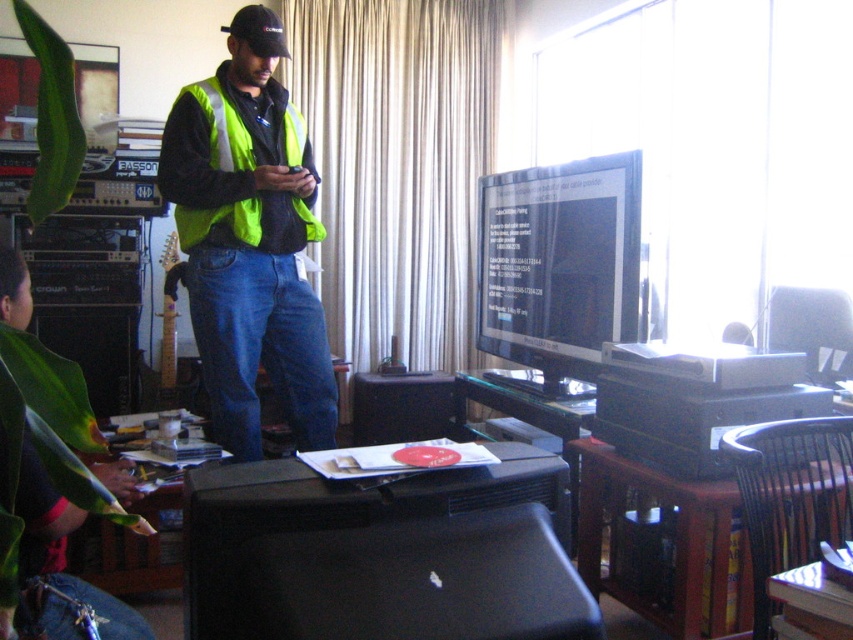
Which is below, black matte printer at lower center or high visibility vest at center?

Positioned lower is black matte printer at lower center.

Can you confirm if black matte printer at lower center is bigger than high visibility vest at center?

No, black matte printer at lower center is not bigger than high visibility vest at center.

Does point (396, 593) come closer to viewer compared to point (193, 108)?

Yes, point (396, 593) is closer to viewer.

In order to click on black matte printer at lower center in this screenshot , I will do point(381,556).

At what (x,y) coordinates should I click in order to perform the action: click on high visibility vest at center. Please return your answer as a coordinate pair (x, y). The image size is (853, 640). Looking at the image, I should click on (248, 240).

Who is lower down, high visibility vest at center or neon yellow reflective safety vest at center?

high visibility vest at center

Describe the element at coordinates (248, 240) in the screenshot. I see `high visibility vest at center` at that location.

You are a GUI agent. You are given a task and a screenshot of the screen. Output one action in this format:
    pyautogui.click(x=<x>, y=<y>)
    Task: Click on the high visibility vest at center
    
    Given the screenshot: What is the action you would take?
    pyautogui.click(x=248, y=240)

Which is below, black matte printer at lower center or neon yellow reflective safety vest at center?

black matte printer at lower center

Is the position of black matte printer at lower center less distant than that of neon yellow reflective safety vest at center?

Yes, black matte printer at lower center is closer to the viewer.

Which is in front, point (306, 595) or point (200, 211)?

Point (306, 595) is in front.

In order to click on black matte printer at lower center in this screenshot , I will do `click(381, 556)`.